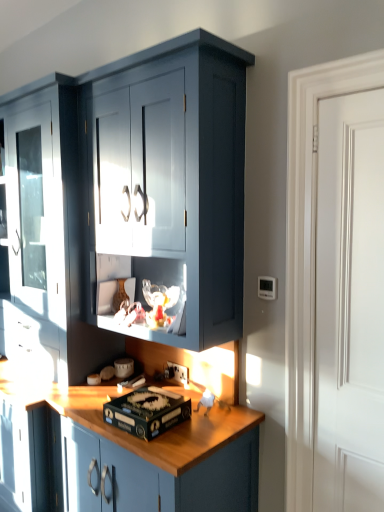
Question: Is matte dark blue cabinet at center in front of or behind white plastic electric outlet at lower center in the image?

Choices:
 (A) behind
 (B) front

Answer: (B)

Question: Choose the correct answer: Is matte dark blue cabinet at center inside white plastic electric outlet at lower center or outside it?

Choices:
 (A) outside
 (B) inside

Answer: (A)

Question: Which object is positioned closest to the white smooth door at right?

Choices:
 (A) matte dark blue cabinet at center
 (B) white plastic electric outlet at lower center
 (C) black cardboard box at center

Answer: (C)

Question: Which of these objects is positioned farthest from the matte dark blue cabinet at center?

Choices:
 (A) white smooth door at right
 (B) white plastic electric outlet at lower center
 (C) black cardboard box at center

Answer: (B)